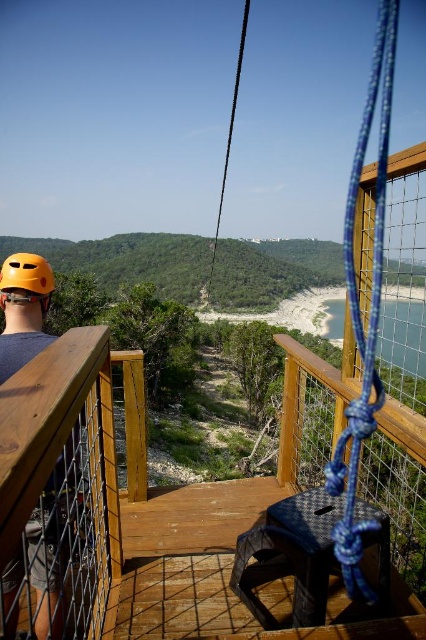
Question: Can you confirm if wooden at upper center is smaller than yellow matte helmet at upper left?

Choices:
 (A) no
 (B) yes

Answer: (B)

Question: Which of the following is the farthest from the observer?

Choices:
 (A) (91, 333)
 (B) (57, 611)

Answer: (A)

Question: Which point is closer to the camera?

Choices:
 (A) wooden at upper center
 (B) yellow matte helmet at upper left

Answer: (A)

Question: From the image, what is the correct spatial relationship of wooden at upper center in relation to matte yellow helmet at left?

Choices:
 (A) right
 (B) left

Answer: (A)

Question: Does matte yellow helmet at left have a greater width compared to yellow matte helmet at upper left?

Choices:
 (A) no
 (B) yes

Answer: (A)

Question: Which object appears closest to the camera in this image?

Choices:
 (A) yellow matte helmet at upper left
 (B) matte yellow helmet at left

Answer: (B)